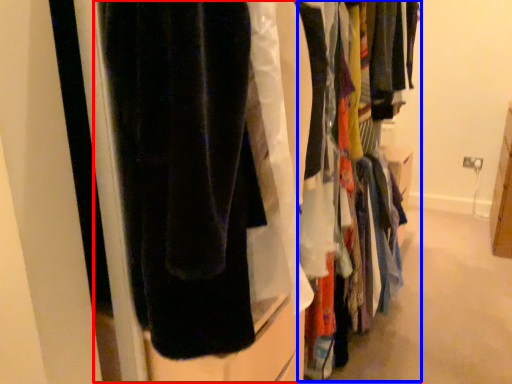
Question: Which object appears farthest to the camera in this image, closet (highlighted by a red box) or closet (highlighted by a blue box)?

Choices:
 (A) closet
 (B) closet

Answer: (B)